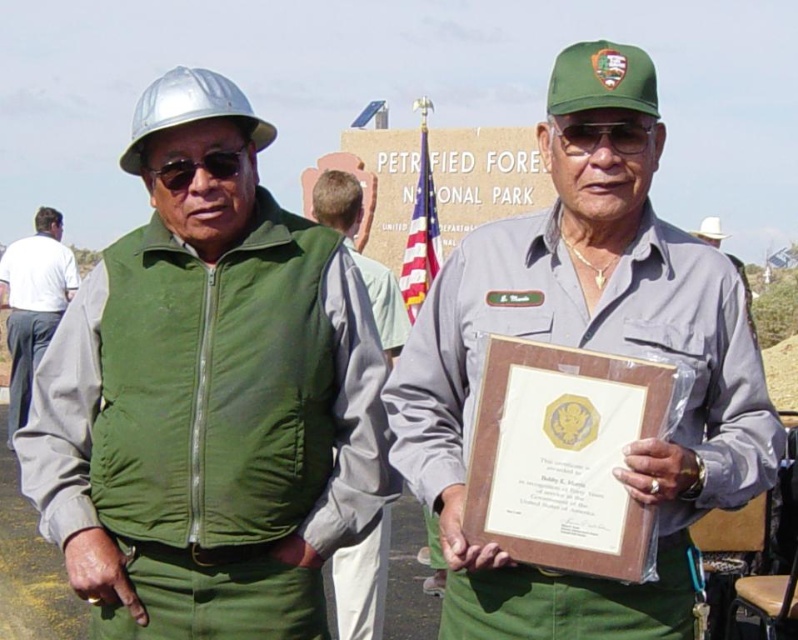
You are a safety inspector at the national park and need to ensure that the green matte vest at center and the glossy plastic goggles at center meet the required size standards. According to the park regulations, the vest must be wider than the goggles. Does the current setup comply with the safety requirements?

The green matte vest at center has a larger width than the glossy plastic goggles at center, so the current setup complies with the safety requirements.

You are a visitor at the national park entrance and see the american flag at center and sunglasses at center. Which object is positioned to the right of the other?

The american flag at center is positioned to the right of sunglasses at center.

You are standing at the national park entrance and want to take a photo of the point at coordinates (366, 547). The park requires that visitors maintain a minimum distance of 50 meters from all points of interest. Is your current position compliant with this rule?

The point at coordinates (366, 547) is 50.69 meters away from you, which exceeds the required minimum distance of 50 meters. Therefore, your current position is compliant with the park rules.